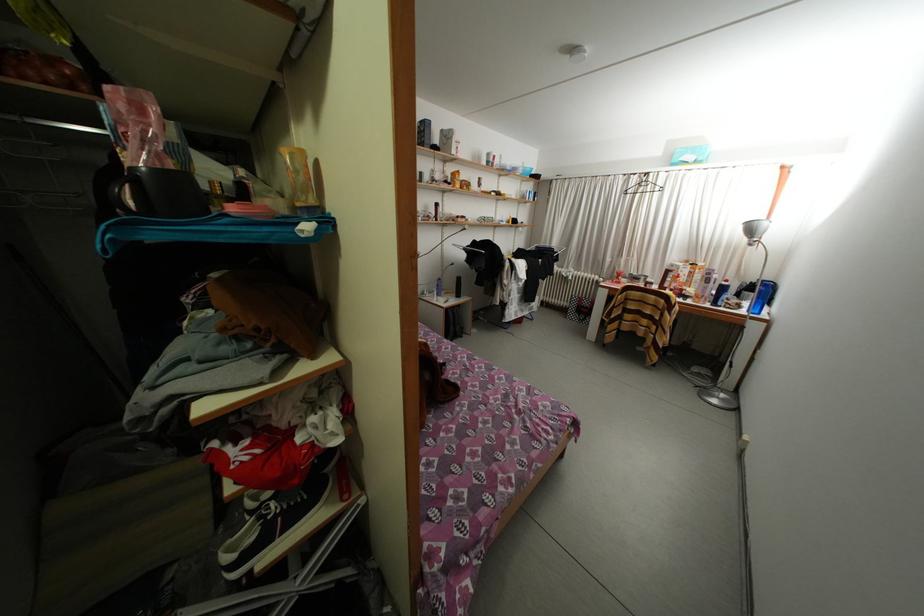
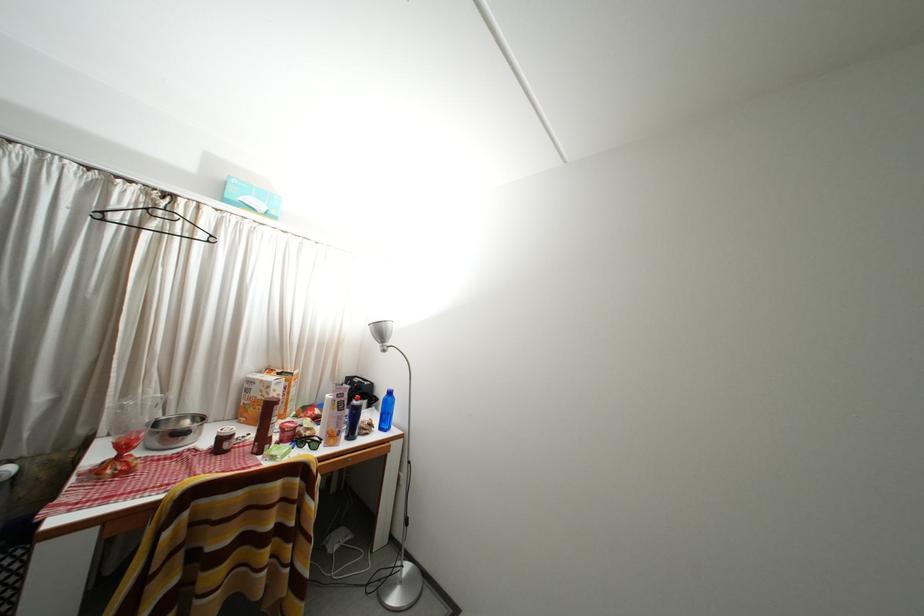
Find the pixel in the second image that matches [699,163] in the first image.

(268, 211)